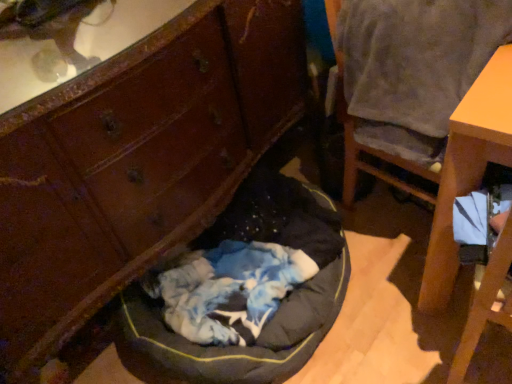
Question: Is wooden dresser at lower left wider or thinner than gray fabric chair at upper right?

Choices:
 (A) wide
 (B) thin

Answer: (A)

Question: From a real-world perspective, is wooden dresser at lower left physically located above or below gray fabric chair at upper right?

Choices:
 (A) below
 (B) above

Answer: (B)

Question: Which object is the farthest from the dark gray fabric dog bed at center?

Choices:
 (A) wooden dresser at lower left
 (B) gray fabric chair at upper right

Answer: (B)

Question: Which of these objects is positioned closest to the gray fabric chair at upper right?

Choices:
 (A) wooden dresser at lower left
 (B) dark gray fabric dog bed at center

Answer: (A)